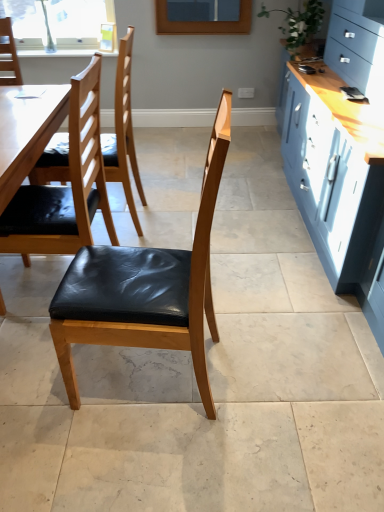
Question: Is matte black leather chair at center, the 1th chair from the front, taller than black leather chair at left, the first chair from the back?

Choices:
 (A) yes
 (B) no

Answer: (B)

Question: Is matte black leather chair at center, the 1th chair from the front, not inside black leather chair at left, positioned as the 3th chair in front-to-back order?

Choices:
 (A) no
 (B) yes

Answer: (B)

Question: Is the position of matte black leather chair at center, positioned as the 3th chair in back-to-front order, more distant than that of black leather chair at left, the first chair from the back?

Choices:
 (A) no
 (B) yes

Answer: (A)

Question: Can you confirm if matte black leather chair at center, positioned as the 3th chair in back-to-front order, is shorter than black leather chair at left, positioned as the 3th chair in front-to-back order?

Choices:
 (A) yes
 (B) no

Answer: (A)

Question: From the image's perspective, is matte black leather chair at center, the 1th chair from the front, located above black leather chair at left, positioned as the 3th chair in front-to-back order?

Choices:
 (A) yes
 (B) no

Answer: (B)

Question: Could you tell me if matte black leather chair at center, the 1th chair from the front, is turned towards black leather chair at left, the first chair from the back?

Choices:
 (A) no
 (B) yes

Answer: (A)

Question: Is matte black leather chair at center, the 1th chair from the front, further to the viewer compared to green leafy plant at upper right?

Choices:
 (A) no
 (B) yes

Answer: (A)

Question: Does matte black leather chair at center, positioned as the 3th chair in back-to-front order, come in front of green leafy plant at upper right?

Choices:
 (A) no
 (B) yes

Answer: (B)

Question: Is matte black leather chair at center, the 1th chair from the front, taller than green leafy plant at upper right?

Choices:
 (A) yes
 (B) no

Answer: (A)

Question: From the image's perspective, is matte black leather chair at center, the 1th chair from the front, on top of green leafy plant at upper right?

Choices:
 (A) no
 (B) yes

Answer: (A)

Question: Does matte black leather chair at center, the 1th chair from the front, have a larger size compared to green leafy plant at upper right?

Choices:
 (A) yes
 (B) no

Answer: (A)

Question: Does matte black leather chair at center, the 1th chair from the front, contain green leafy plant at upper right?

Choices:
 (A) no
 (B) yes

Answer: (A)

Question: Does green leafy plant at upper right have a greater width compared to clear glass window at upper left?

Choices:
 (A) no
 (B) yes

Answer: (B)